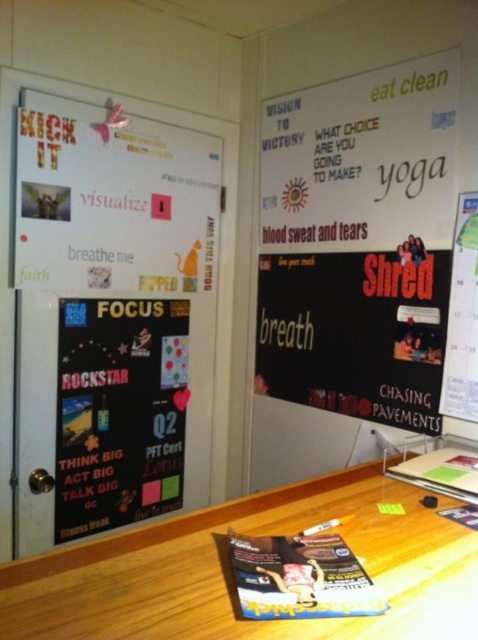
You are a student who needs to hang a 24 inch wide poster. You see the white matte bulletin board at upper right and the matte black poster at center. Can you fit the poster between them?

The distance between the white matte bulletin board at upper right and the matte black poster at center is 23.96 inches. Since the poster is 24 inches wide, it would not fit as the space is slightly narrower than the poster.

You are organizing a small event and need to place a 24 inch wide banner between the wooden table at lower center and the matte black poster at upper right. Will there be enough space?

The wooden table at lower center and the matte black poster at upper right are 23.58 inches apart. Since the banner is 24 inches wide, it will not fit between them as the space is slightly narrower.

You are a person who is 6 feet tall and standing at the camera position. You want to place a 12 inch tall statue on the wooden table at lower center. Can you reach the table from your current position without moving your feet?

The wooden table at lower center is 27.53 inches away from the camera. Since you are 6 feet tall, your average reach distance while standing still is about 24 inches. Therefore, you cannot reach the wooden table at lower center from your current position without moving your feet.